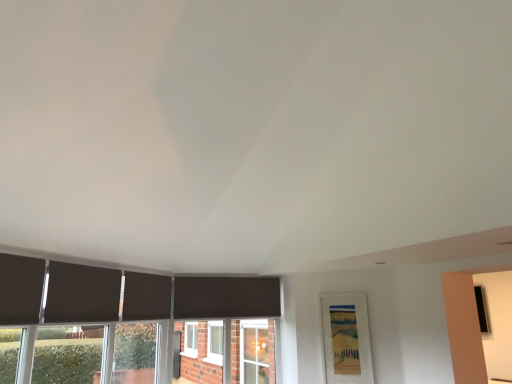
Describe the element at coordinates (82, 293) in the screenshot. I see `dark matte curtain at lower left, acting as the second curtain starting from the left` at that location.

The width and height of the screenshot is (512, 384). Identify the location of dark matte curtain at left, the 3th curtain in the right-to-left sequence. (20, 289).

Find the location of a particular element. matte black curtain at center, which is counted as the first curtain, starting from the back is located at coordinates (146, 296).

Based on their sizes in the image, would you say dark matte curtain at left, arranged as the 1th curtain when viewed from the left, is bigger or smaller than matte black curtain at center, which is counted as the first curtain, starting from the back?

Clearly, dark matte curtain at left, arranged as the 1th curtain when viewed from the left, is smaller in size than matte black curtain at center, which is counted as the first curtain, starting from the back.

How much distance is there between dark matte curtain at left, the 3th curtain in the right-to-left sequence, and matte black curtain at center, the 3th curtain viewed from the left?

dark matte curtain at left, the 3th curtain in the right-to-left sequence, is 3.33 feet from matte black curtain at center, the 3th curtain viewed from the left.

Is dark matte curtain at left, the first curtain viewed from the front, located outside matte black curtain at center, which is counted as the first curtain, starting from the back?

dark matte curtain at left, the first curtain viewed from the front, lies outside matte black curtain at center, which is counted as the first curtain, starting from the back,'s area.

Between point (17, 299) and point (137, 274), which one is positioned behind?

The point (137, 274) is farther from the camera.

Is point (49, 282) behind point (35, 309)?

Yes, it is.

Where is `curtain in front of the dark matte curtain at lower left, acting as the second curtain starting from the left`? This screenshot has height=384, width=512. curtain in front of the dark matte curtain at lower left, acting as the second curtain starting from the left is located at coordinates (20, 289).

Are dark matte curtain at lower left, arranged as the 2th curtain when viewed from the right, and dark matte curtain at left, the 3th curtain in the right-to-left sequence, far apart?

No, dark matte curtain at lower left, arranged as the 2th curtain when viewed from the right, is in close proximity to dark matte curtain at left, the 3th curtain in the right-to-left sequence.

Would you say dark matte curtain at left, arranged as the 1th curtain when viewed from the left, contains dark matte curtain at lower left, acting as the second curtain starting from the left?

Definitely not — dark matte curtain at lower left, acting as the second curtain starting from the left, is not inside dark matte curtain at left, arranged as the 1th curtain when viewed from the left.

Does dark matte curtain at left, the 3th curtain in the right-to-left sequence, touch dark matte curtain at lower left, arranged as the 2th curtain when viewed from the right?

They are not placed beside each other.

Who is bigger, dark matte curtain at left, which is counted as the third curtain, starting from the back, or dark matte curtain at lower left, acting as the second curtain starting from the left?

dark matte curtain at lower left, acting as the second curtain starting from the left.

Considering the sizes of objects matte black curtain at center, the first curtain viewed from the right, and dark matte curtain at left, the 3th curtain in the right-to-left sequence, in the image provided, who is shorter, matte black curtain at center, the first curtain viewed from the right, or dark matte curtain at left, the 3th curtain in the right-to-left sequence,?

matte black curtain at center, the first curtain viewed from the right.

From the image's perspective, is matte black curtain at center, the third curtain viewed from the front, positioned above or below dark matte curtain at left, the 3th curtain in the right-to-left sequence?

From the image's perspective, matte black curtain at center, the third curtain viewed from the front, appears below dark matte curtain at left, the 3th curtain in the right-to-left sequence.

Does matte black curtain at center, the first curtain viewed from the right, appear on the left side of dark matte curtain at left, the 3th curtain in the right-to-left sequence?

In fact, matte black curtain at center, the first curtain viewed from the right, is to the right of dark matte curtain at left, the 3th curtain in the right-to-left sequence.

Is matte black curtain at center, the first curtain viewed from the right, situated inside dark matte curtain at left, the first curtain viewed from the front, or outside?

matte black curtain at center, the first curtain viewed from the right, lies outside dark matte curtain at left, the first curtain viewed from the front.

Considering the relative sizes of dark matte curtain at lower left, acting as the second curtain starting from the left, and matte black curtain at center, which is counted as the first curtain, starting from the back, in the image provided, is dark matte curtain at lower left, acting as the second curtain starting from the left, thinner than matte black curtain at center, which is counted as the first curtain, starting from the back,?

Correct, the width of dark matte curtain at lower left, acting as the second curtain starting from the left, is less than that of matte black curtain at center, which is counted as the first curtain, starting from the back.

What's the angular difference between dark matte curtain at lower left, which is counted as the 2th curtain, starting from the back, and matte black curtain at center, the 3th curtain viewed from the left,'s facing directions?

There is a 0.0084-degree angle between the facing directions of dark matte curtain at lower left, which is counted as the 2th curtain, starting from the back, and matte black curtain at center, the 3th curtain viewed from the left.

From the image's perspective, between dark matte curtain at lower left, arranged as the 2th curtain when viewed from the right, and matte black curtain at center, which is counted as the first curtain, starting from the back, who is located below?

matte black curtain at center, which is counted as the first curtain, starting from the back.

Does dark matte curtain at lower left, acting as the second curtain starting from the left, appear on the left side of matte black curtain at center, the first curtain viewed from the right?

Yes.

Is matte black curtain at center, the 3th curtain viewed from the left, not within dark matte curtain at lower left, arranged as the 2th curtain when viewed from the right?

Yes, matte black curtain at center, the 3th curtain viewed from the left, is outside of dark matte curtain at lower left, arranged as the 2th curtain when viewed from the right.

Is matte black curtain at center, the 3th curtain viewed from the left, thinner than dark matte curtain at lower left, arranged as the 2th curtain when viewed from the right?

In fact, matte black curtain at center, the 3th curtain viewed from the left, might be wider than dark matte curtain at lower left, arranged as the 2th curtain when viewed from the right.

How distant is matte black curtain at center, the third curtain viewed from the front, from dark matte curtain at lower left, the second curtain positioned from the front?

matte black curtain at center, the third curtain viewed from the front, and dark matte curtain at lower left, the second curtain positioned from the front, are 41.55 centimeters apart from each other.

Which curtain is the 2nd one when counting from the back of the dark matte curtain at left, the first curtain viewed from the front? Please provide its 2D coordinates.

[(146, 296)]

Where is `curtain below the dark matte curtain at lower left, which is counted as the 2th curtain, starting from the back (from a real-world perspective)`? This screenshot has width=512, height=384. curtain below the dark matte curtain at lower left, which is counted as the 2th curtain, starting from the back (from a real-world perspective) is located at coordinates (20, 289).

From the image, which object appears to be farther from dark matte curtain at lower left, which is counted as the 2th curtain, starting from the back, matte black curtain at center, the 3th curtain viewed from the left, or dark matte curtain at left, arranged as the 1th curtain when viewed from the left?

Based on the image, matte black curtain at center, the 3th curtain viewed from the left, appears to be further to dark matte curtain at lower left, which is counted as the 2th curtain, starting from the back.

Estimate the real-world distances between objects in this image. Which object is further from matte black curtain at center, which is counted as the first curtain, starting from the back, dark matte curtain at lower left, arranged as the 2th curtain when viewed from the right, or dark matte curtain at left, arranged as the 1th curtain when viewed from the left?

dark matte curtain at left, arranged as the 1th curtain when viewed from the left, is further to matte black curtain at center, which is counted as the first curtain, starting from the back.

Which object lies further to the anchor point dark matte curtain at lower left, the second curtain positioned from the front, dark matte curtain at left, which is counted as the third curtain, starting from the back, or matte black curtain at center, the first curtain viewed from the right?

Among the two, matte black curtain at center, the first curtain viewed from the right, is located further to dark matte curtain at lower left, the second curtain positioned from the front.

Looking at the image, which one is located closer to dark matte curtain at left, the 3th curtain in the right-to-left sequence, dark matte curtain at lower left, acting as the second curtain starting from the left, or matte black curtain at center, which is counted as the first curtain, starting from the back?

dark matte curtain at lower left, acting as the second curtain starting from the left, is closer to dark matte curtain at left, the 3th curtain in the right-to-left sequence.

Consider the image. From the image, which object appears to be farther from matte black curtain at center, the 3th curtain viewed from the left, dark matte curtain at left, the 3th curtain in the right-to-left sequence, or dark matte curtain at lower left, which is counted as the 2th curtain, starting from the back?

dark matte curtain at left, the 3th curtain in the right-to-left sequence, lies further to matte black curtain at center, the 3th curtain viewed from the left, than the other object.

Estimate the real-world distances between objects in this image. Which object is closer to dark matte curtain at left, the first curtain viewed from the front, matte black curtain at center, which is counted as the first curtain, starting from the back, or dark matte curtain at lower left, acting as the second curtain starting from the left?

Among the two, dark matte curtain at lower left, acting as the second curtain starting from the left, is located nearer to dark matte curtain at left, the first curtain viewed from the front.

Where is `curtain between dark matte curtain at left, the 3th curtain in the right-to-left sequence, and matte black curtain at center, the 3th curtain viewed from the left, in the front-back direction`? This screenshot has height=384, width=512. curtain between dark matte curtain at left, the 3th curtain in the right-to-left sequence, and matte black curtain at center, the 3th curtain viewed from the left, in the front-back direction is located at coordinates (82, 293).